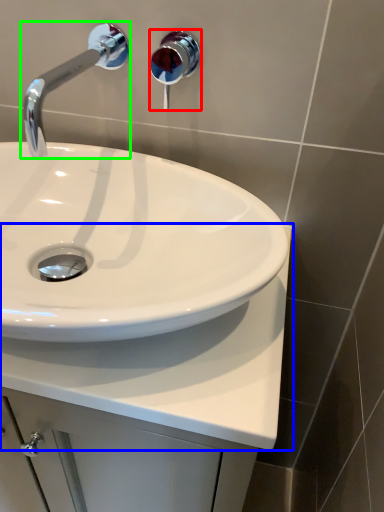
Question: Based on their relative distances, which object is nearer to shower (highlighted by a red box)? Choose from counter top (highlighted by a blue box) and tap (highlighted by a green box).

Choices:
 (A) counter top
 (B) tap

Answer: (B)